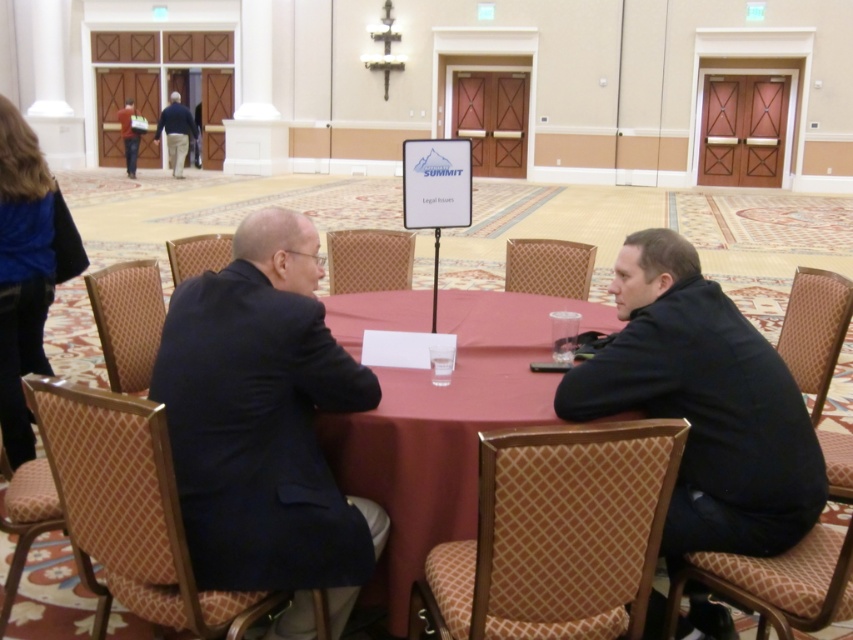
You are an event organizer and need to arrange seating for two guests based on their attire. The guests are wearing the dark blue suit at center and the dark blue jacket at upper left. Which guest should sit closer to the microphone stand to ensure their attire is properly visible to the audience?

The dark blue jacket at upper left should sit closer to the microphone stand because it has a greater height compared to the dark blue suit at center, making it more visible to the audience.

You are attending a legal seminar and need to sit down. You see the black matte jacket at right and the maroon fabric table at center. Which object is closer to the right side of the room?

The black matte jacket at right is closer to the right side of the room because it is positioned to the right of the maroon fabric table at center.